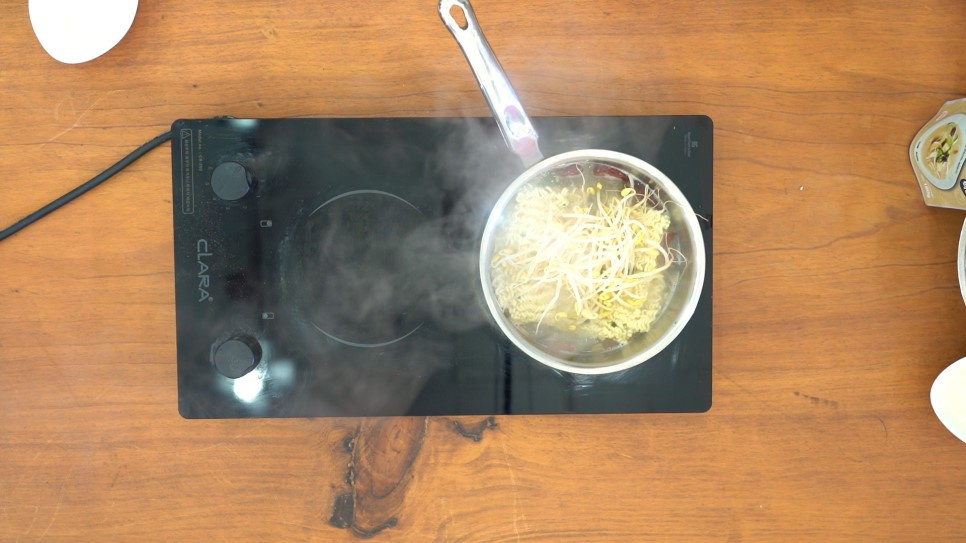
Locate an element on the screen. countertop burner is located at coordinates (378, 290).